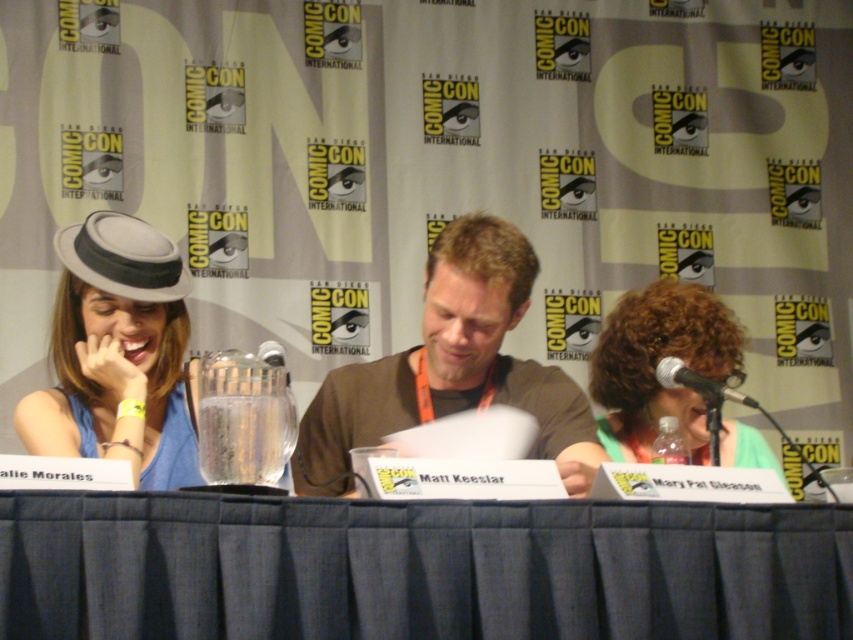
Question: Which of the following is the farthest from the observer?

Choices:
 (A) black plastic microphone at center
 (B) black metallic microphone at right

Answer: (B)

Question: Considering the relative positions of blue fabric table at center and black metallic microphone at right in the image provided, where is blue fabric table at center located with respect to black metallic microphone at right?

Choices:
 (A) right
 (B) left

Answer: (B)

Question: Which point is closer to the camera taking this photo?

Choices:
 (A) (699, 384)
 (B) (659, 404)
 (C) (78, 556)

Answer: (C)

Question: Is brown cotton shirt at center below matte gray hat at left?

Choices:
 (A) yes
 (B) no

Answer: (A)

Question: Which object is positioned closest to the brown cotton shirt at center?

Choices:
 (A) matte gray hat at left
 (B) blue fabric table at center
 (C) black plastic microphone at center
 (D) black metallic microphone at right

Answer: (C)

Question: Is matte gray hat at left below black plastic microphone at center?

Choices:
 (A) no
 (B) yes

Answer: (A)